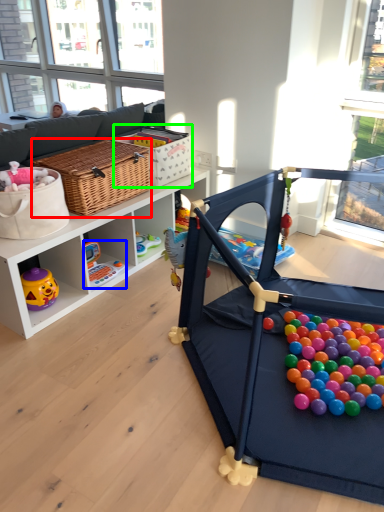
Question: Based on their relative distances, which object is farther from picnic basket (highlighted by a red box)? Choose from toy (highlighted by a blue box) and basket (highlighted by a green box).

Choices:
 (A) toy
 (B) basket

Answer: (A)